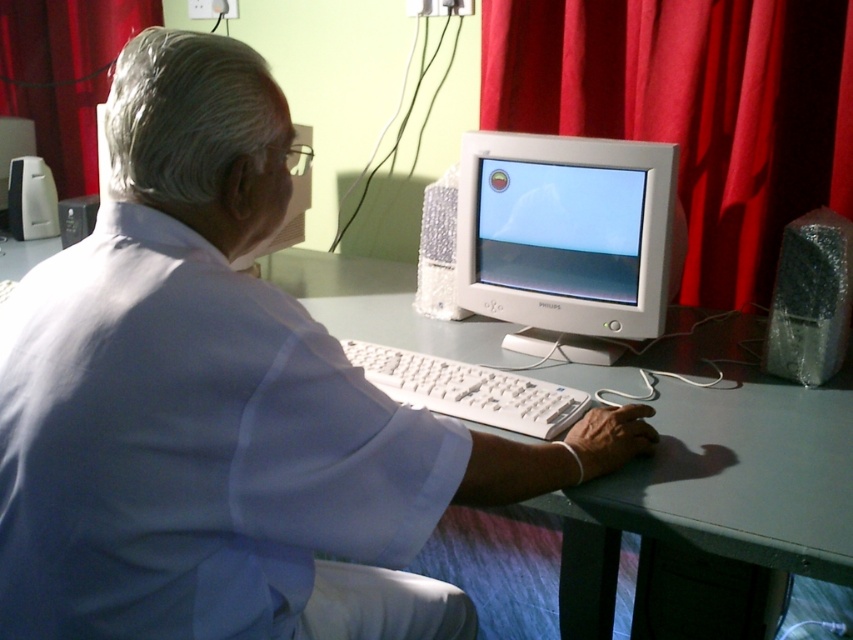
Is white plastic monitor at center shorter than matte plastic monitor at center?

In fact, white plastic monitor at center may be taller than matte plastic monitor at center.

Is the position of white plastic monitor at center less distant than that of matte plastic monitor at center?

Yes, it is.

Describe the element at coordinates (567, 234) in the screenshot. I see `white plastic monitor at center` at that location.

Locate an element on the screen. The image size is (853, 640). white plastic monitor at center is located at coordinates (567, 234).

Who is taller, matte plastic monitor at center or white plastic desktop computer at left?

matte plastic monitor at center is taller.

Does matte plastic monitor at center appear on the left side of white plastic desktop computer at left?

In fact, matte plastic monitor at center is to the right of white plastic desktop computer at left.

You are a GUI agent. You are given a task and a screenshot of the screen. Output one action in this format:
    pyautogui.click(x=<x>, y=<y>)
    Task: Click on the matte plastic monitor at center
    This screenshot has width=853, height=640.
    Given the screenshot: What is the action you would take?
    pyautogui.click(x=560, y=228)

Identify the location of matte plastic monitor at center. This screenshot has width=853, height=640. (560, 228).

Who is taller, red fabric curtain at upper center or red fabric curtain at upper left?

red fabric curtain at upper center

Does point (643, 134) lie behind point (32, 100)?

No.

The height and width of the screenshot is (640, 853). In order to click on red fabric curtain at upper center in this screenshot , I will do `click(692, 109)`.